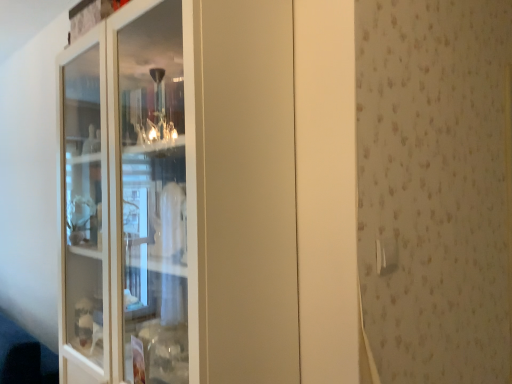
Question: From a real-world perspective, is white plastic door handle at upper right below white glass cabinet at left?

Choices:
 (A) no
 (B) yes

Answer: (B)

Question: Considering the relative sizes of white plastic door handle at upper right and white glass cabinet at left in the image provided, is white plastic door handle at upper right bigger than white glass cabinet at left?

Choices:
 (A) yes
 (B) no

Answer: (B)

Question: Is white plastic door handle at upper right to the right of white glass cabinet at left from the viewer's perspective?

Choices:
 (A) no
 (B) yes

Answer: (B)

Question: Can you confirm if white plastic door handle at upper right is positioned to the left of white glass cabinet at left?

Choices:
 (A) yes
 (B) no

Answer: (B)

Question: From a real-world perspective, is white plastic door handle at upper right located higher than white glass cabinet at left?

Choices:
 (A) yes
 (B) no

Answer: (B)

Question: Can you confirm if white plastic door handle at upper right is taller than white glass cabinet at left?

Choices:
 (A) yes
 (B) no

Answer: (B)

Question: Is the surface of white glass cabinet at left in direct contact with white plastic door handle at upper right?

Choices:
 (A) no
 (B) yes

Answer: (A)

Question: Is white glass cabinet at left positioned far away from white plastic door handle at upper right?

Choices:
 (A) no
 (B) yes

Answer: (A)

Question: From the image's perspective, does white glass cabinet at left appear lower than white plastic door handle at upper right?

Choices:
 (A) no
 (B) yes

Answer: (A)

Question: Is white plastic door handle at upper right completely or partially inside white glass cabinet at left?

Choices:
 (A) no
 (B) yes

Answer: (A)

Question: Can you confirm if white glass cabinet at left is taller than white plastic door handle at upper right?

Choices:
 (A) yes
 (B) no

Answer: (A)

Question: From a real-world perspective, is white glass cabinet at left located higher than white plastic door handle at upper right?

Choices:
 (A) no
 (B) yes

Answer: (B)

Question: Considering the relative positions of white plastic door handle at upper right and white glass cabinet at left in the image provided, is white plastic door handle at upper right to the left or to the right of white glass cabinet at left?

Choices:
 (A) left
 (B) right

Answer: (B)